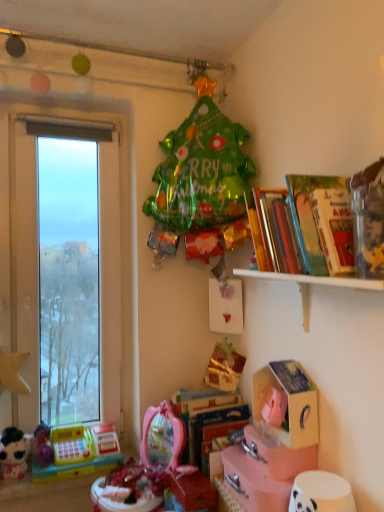
Image resolution: width=384 pixels, height=512 pixels. I want to click on vacant space underneath yellow plastic cash register at lower left, the 3th toy viewed from the right (from a real-world perspective), so click(70, 475).